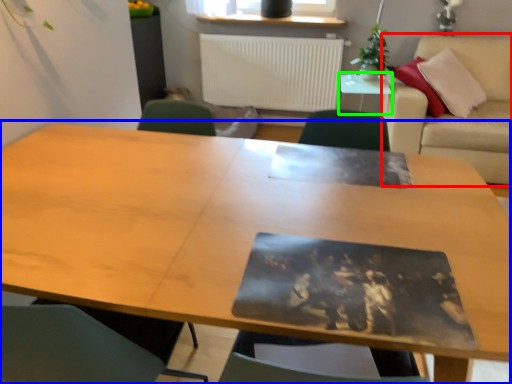
Question: Which is nearer to the couch (highlighted by a red box)? table (highlighted by a blue box) or side table (highlighted by a green box).

Choices:
 (A) table
 (B) side table

Answer: (B)